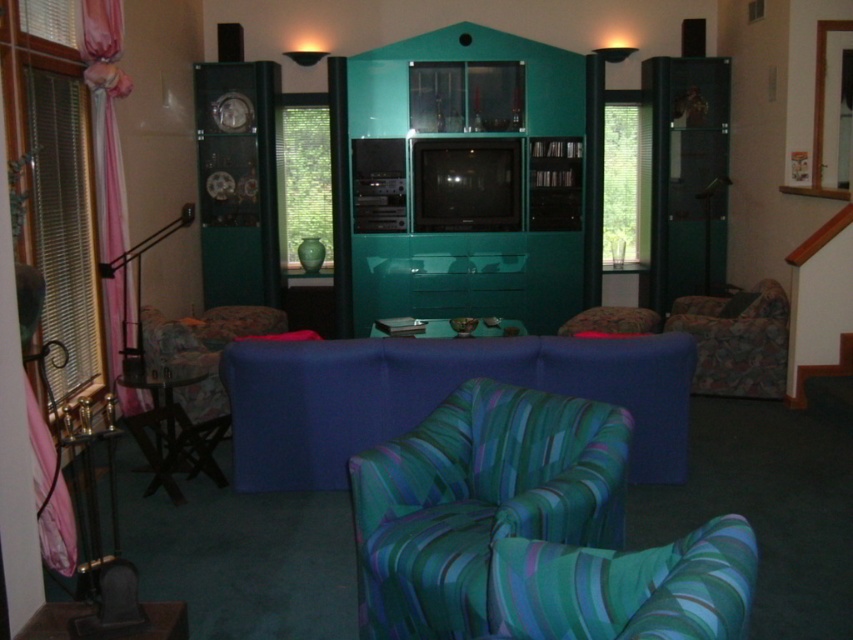
Does green striped fabric chair at lower center appear on the left side of patterned fabric armchair at right?

Indeed, green striped fabric chair at lower center is positioned on the left side of patterned fabric armchair at right.

Locate an element on the screen. green striped fabric chair at lower center is located at coordinates [x=625, y=588].

Does point (357, 368) come farther from viewer compared to point (393, 333)?

No, it is not.

Where is `blue fabric couch at center`? blue fabric couch at center is located at coordinates (434, 396).

Does point (294, 465) come closer to viewer compared to point (387, 326)?

Yes, it is.

At what (x,y) coordinates should I click in order to perform the action: click on blue fabric couch at center. Please return your answer as a coordinate pair (x, y). Looking at the image, I should click on (434, 396).

Can you confirm if blue fabric couch at lower left is bigger than metallic silver tray at center?

Indeed, blue fabric couch at lower left has a larger size compared to metallic silver tray at center.

Who is taller, blue fabric couch at lower left or metallic silver tray at center?

With more height is blue fabric couch at lower left.

Describe the element at coordinates (202, 348) in the screenshot. I see `blue fabric couch at lower left` at that location.

Identify the location of blue fabric couch at lower left. (202, 348).